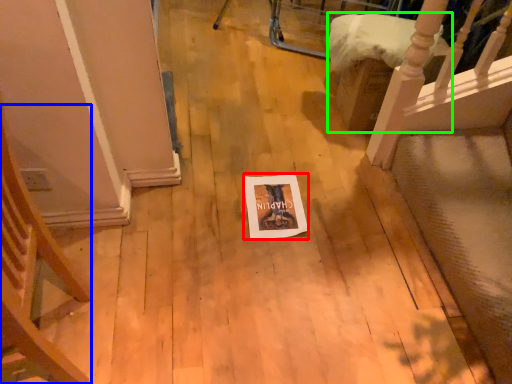
Question: Which is nearer to the postcard (highlighted by a red box)? armchair (highlighted by a blue box) or furniture (highlighted by a green box).

Choices:
 (A) armchair
 (B) furniture

Answer: (B)